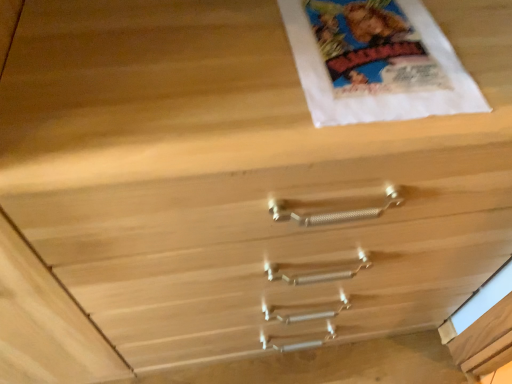
You are a GUI agent. You are given a task and a screenshot of the screen. Output one action in this format:
    pyautogui.click(x=<x>, y=<y>)
    Task: Click on the white paper comic book at upper center
    The height and width of the screenshot is (384, 512).
    Given the screenshot: What is the action you would take?
    pyautogui.click(x=372, y=48)

Measure the distance between white paper comic book at upper center and camera.

The distance of white paper comic book at upper center from camera is 19.77 inches.

This screenshot has width=512, height=384. What do you see at coordinates (372, 48) in the screenshot?
I see `white paper comic book at upper center` at bounding box center [372, 48].

This screenshot has width=512, height=384. In order to click on white paper comic book at upper center in this screenshot , I will do `click(372, 48)`.